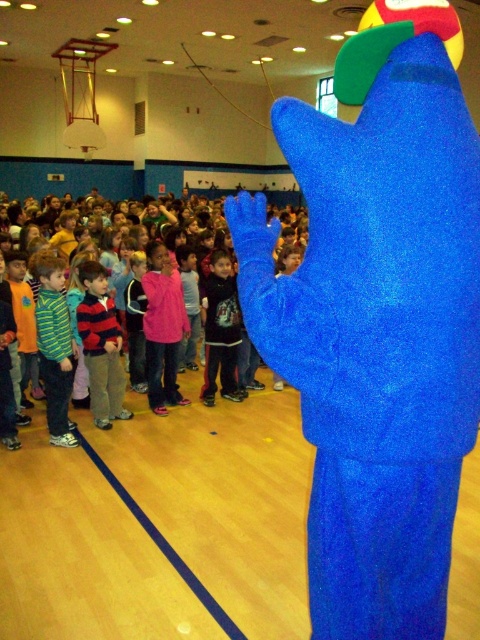
Which of these two, striped sweater at center or dark blue fleece jacket at center, stands taller?

With more height is dark blue fleece jacket at center.

The width and height of the screenshot is (480, 640). I want to click on striped sweater at center, so click(x=100, y=346).